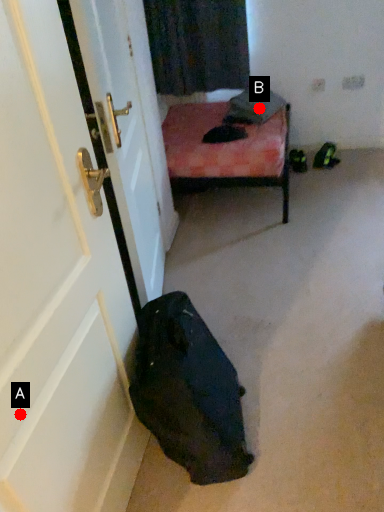
Question: Two points are circled on the image, labeled by A and B beside each circle. Which point appears farthest from the camera in this image?

Choices:
 (A) A is further
 (B) B is further

Answer: (B)